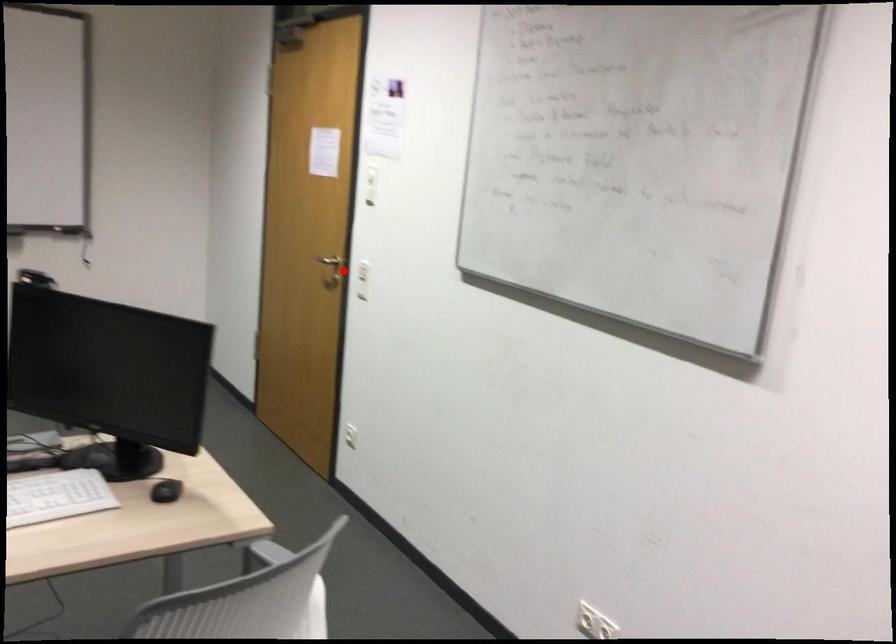
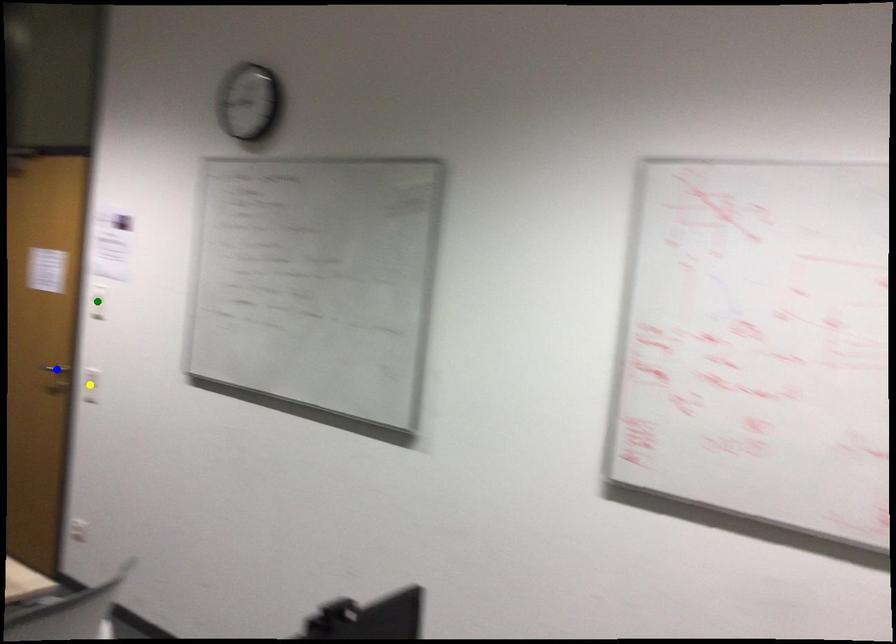
Question: I am providing you with two images of the same scene from different viewpoints. A red point is marked on the first image. You are given multiple points on the second image. Which spot in image 2 lines up with the point in image 1?

Choices:
 (A) yellow point
 (B) green point
 (C) blue point

Answer: (A)